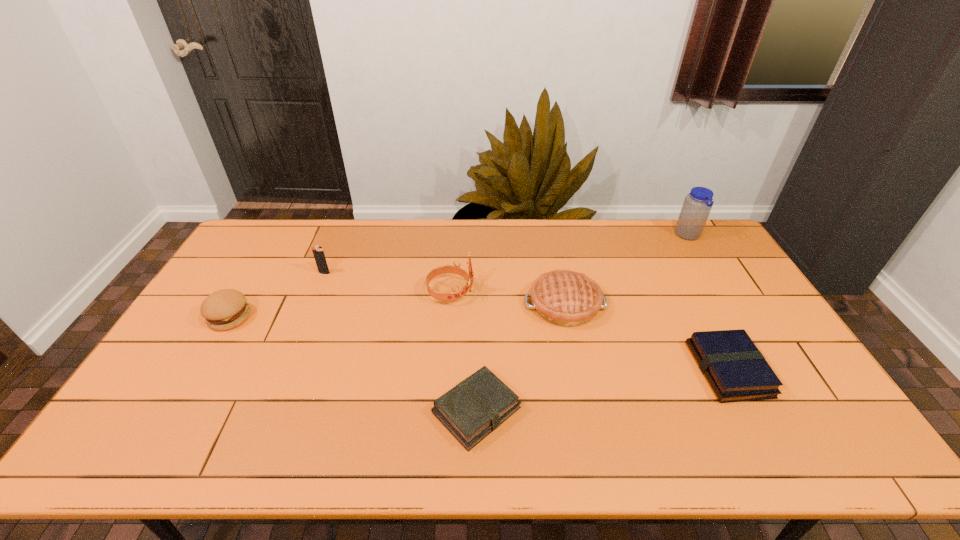
Where is `free space that is in between the left book and the right book`? The height and width of the screenshot is (540, 960). free space that is in between the left book and the right book is located at coordinates (603, 390).

The image size is (960, 540). Find the location of `vacant space in between the right book and the tiara`. vacant space in between the right book and the tiara is located at coordinates (589, 331).

What are the coordinates of `free point between the tiara and the leftmost object` in the screenshot? It's located at (341, 305).

Locate an element on the screen. The width and height of the screenshot is (960, 540). vacant space that is in between the right book and the pie is located at coordinates (646, 337).

Locate an element on the screen. This screenshot has width=960, height=540. empty space between the third tallest object and the hamburger is located at coordinates (277, 295).

Where is `free space between the right book and the leftmost object`? free space between the right book and the leftmost object is located at coordinates (479, 343).

Where is `vacant space that's between the third object from right to left and the tiara`? The width and height of the screenshot is (960, 540). vacant space that's between the third object from right to left and the tiara is located at coordinates (508, 298).

Where is `free point between the leftmost object and the left book`? Image resolution: width=960 pixels, height=540 pixels. free point between the leftmost object and the left book is located at coordinates (353, 363).

Locate which object is the fifth closest to the left book. Please provide its 2D coordinates. Your answer should be formatted as a tuple, i.e. [(x, y)], where the tuple contains the x and y coordinates of a point satisfying the conditions above.

[(225, 309)]

This screenshot has width=960, height=540. What are the coordinates of `object that stands as the closest to the farthest object` in the screenshot? It's located at (566, 298).